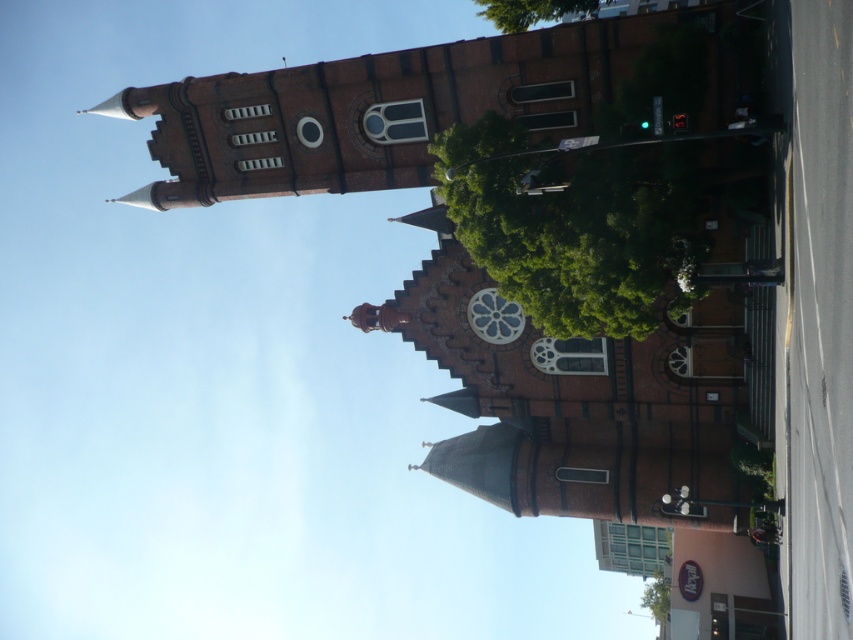
You are standing in front of the historic church and want to take a photo of the pointed spire at the top of the tower. The camera you are using has a zoom lens that can focus on objects up to 300 feet away. Is the point at coordinate point (529, 13) within the camera range?

The point at coordinate point (529, 13) is 330.65 feet from the camera, which is beyond the camera lens range of 300 feet. Therefore, the camera cannot focus on that point.